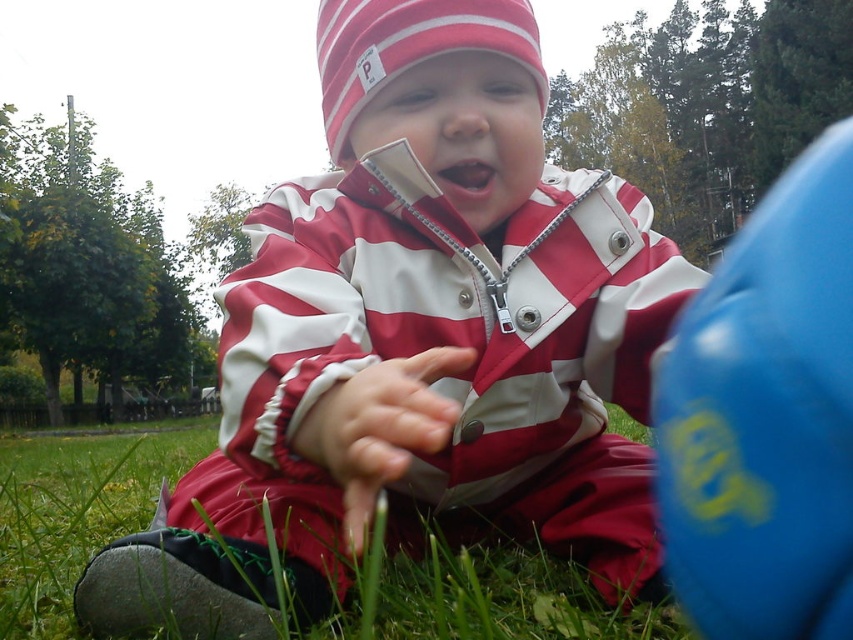
Which is behind, point (254, 532) or point (514, 621)?

The point (254, 532) is more distant.

The image size is (853, 640). Describe the element at coordinates (416, 342) in the screenshot. I see `matte striped jacket at center` at that location.

Image resolution: width=853 pixels, height=640 pixels. What are the coordinates of `matte striped jacket at center` in the screenshot? It's located at (416, 342).

What do you see at coordinates (409, 45) in the screenshot? I see `striped knit hat at upper center` at bounding box center [409, 45].

The height and width of the screenshot is (640, 853). Identify the location of striped knit hat at upper center. 409,45.

Find the location of a particular element. This screenshot has width=853, height=640. striped knit hat at upper center is located at coordinates (409, 45).

Which of these two, blue rubber ball at right or green grass at lower center, stands shorter?

green grass at lower center is shorter.

The image size is (853, 640). What do you see at coordinates (766, 417) in the screenshot? I see `blue rubber ball at right` at bounding box center [766, 417].

Measure the distance between blue rubber ball at right and camera.

blue rubber ball at right and camera are 9.65 inches apart from each other.

Locate an element on the screen. The height and width of the screenshot is (640, 853). blue rubber ball at right is located at coordinates (766, 417).